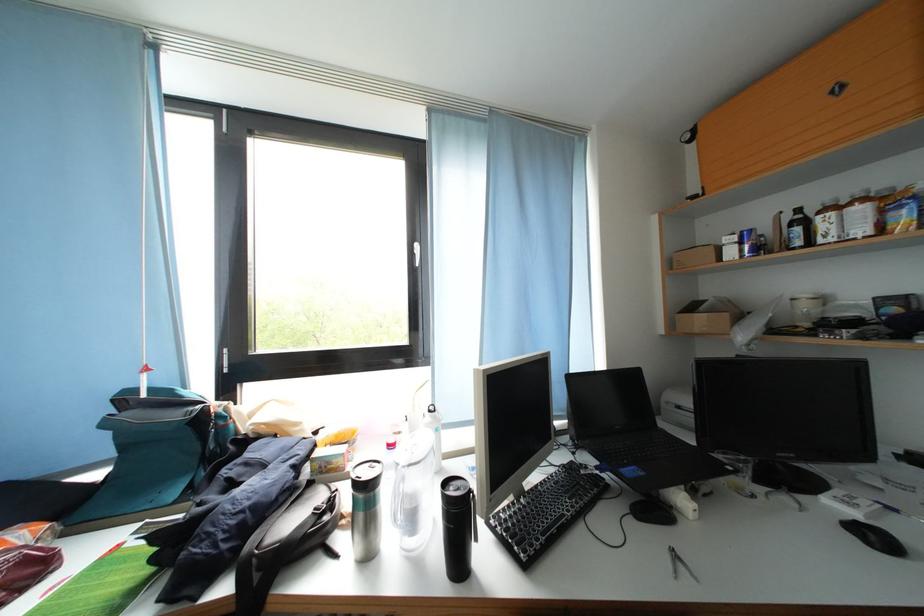
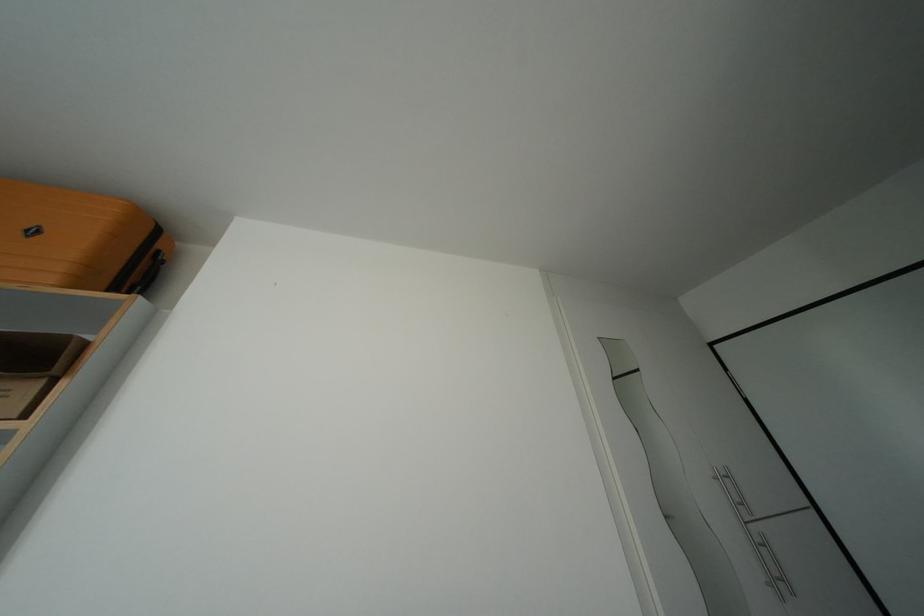
In the second image, find the point that corresponds to (846,94) in the first image.

(42, 237)